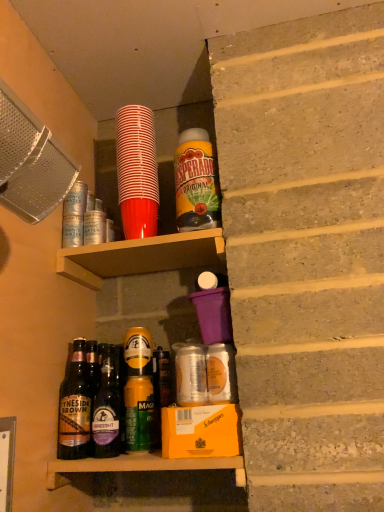
Question: From a real-world perspective, is dark brown glass bottle at center, the fourth bottle from the right, located beneath purple plastic cup at upper center?

Choices:
 (A) yes
 (B) no

Answer: (A)

Question: Does dark brown glass bottle at center, positioned as the 2th bottle in left-to-right order, have a greater height compared to purple plastic cup at upper center?

Choices:
 (A) no
 (B) yes

Answer: (B)

Question: Is dark brown glass bottle at center, the fourth bottle from the right, facing towards purple plastic cup at upper center?

Choices:
 (A) no
 (B) yes

Answer: (A)

Question: Is dark brown glass bottle at center, the fourth bottle from the right, closer to camera compared to purple plastic cup at upper center?

Choices:
 (A) yes
 (B) no

Answer: (A)

Question: Is dark brown glass bottle at center, positioned as the 2th bottle in left-to-right order, positioned with its back to purple plastic cup at upper center?

Choices:
 (A) yes
 (B) no

Answer: (B)

Question: Visually, is metallic gold can at center, which is counted as the fourth bottle, starting from the left, positioned to the left or to the right of purple plastic cup at upper center?

Choices:
 (A) right
 (B) left

Answer: (B)

Question: From the image's perspective, relative to purple plastic cup at upper center, is metallic gold can at center, the 2th bottle when ordered from right to left, above or below?

Choices:
 (A) above
 (B) below

Answer: (B)

Question: Does point (124, 354) appear closer or farther from the camera than point (142, 239)?

Choices:
 (A) closer
 (B) farther

Answer: (A)

Question: From their relative heights in the image, would you say metallic gold can at center, which is counted as the fourth bottle, starting from the left, is taller or shorter than purple plastic cup at upper center?

Choices:
 (A) tall
 (B) short

Answer: (A)

Question: From a real-world perspective, is dark brown glass bottle at center, the fourth bottle from the right, above or below brown glass bottle at lower left, the fifth bottle from the right?

Choices:
 (A) below
 (B) above

Answer: (A)

Question: Is dark brown glass bottle at center, positioned as the 2th bottle in left-to-right order, spatially inside brown glass bottle at lower left, the fifth bottle from the right, or outside of it?

Choices:
 (A) inside
 (B) outside

Answer: (B)

Question: In terms of height, does dark brown glass bottle at center, the fourth bottle from the right, look taller or shorter compared to brown glass bottle at lower left, the first bottle when ordered from left to right?

Choices:
 (A) tall
 (B) short

Answer: (B)

Question: From the image's perspective, is dark brown glass bottle at center, positioned as the 2th bottle in left-to-right order, above or below brown glass bottle at lower left, the fifth bottle from the right?

Choices:
 (A) below
 (B) above

Answer: (B)

Question: Considering the positions of point (157, 260) and point (125, 155), is point (157, 260) closer or farther from the camera than point (125, 155)?

Choices:
 (A) closer
 (B) farther

Answer: (B)

Question: Considering the positions of purple plastic cup at upper center and red plastic cup at upper center, positioned as the 3th bottle in left-to-right order, in the image, is purple plastic cup at upper center wider or thinner than red plastic cup at upper center, positioned as the 3th bottle in left-to-right order,?

Choices:
 (A) wide
 (B) thin

Answer: (A)